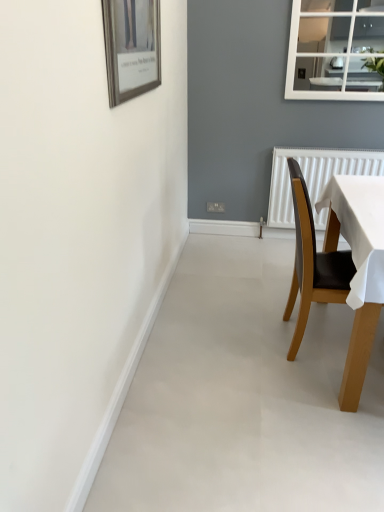
The height and width of the screenshot is (512, 384). I want to click on vacant space in brown wooden chair at right (from a real-world perspective), so click(x=325, y=338).